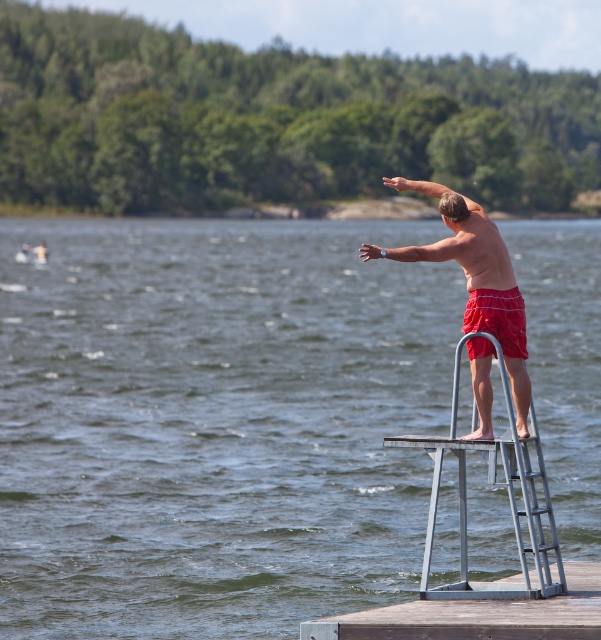
Locate an element on the screen. This screenshot has height=640, width=601. red swim trunks at center is located at coordinates (456, 241).

Describe the element at coordinates (456, 241) in the screenshot. I see `red swim trunks at center` at that location.

Does point (487, 236) come in front of point (501, 332)?

That is False.

Image resolution: width=601 pixels, height=640 pixels. Identify the location of red swim trunks at center. coord(456,241).

Does red cotton shorts at center have a larger size compared to matte white wristwatch at upper right?

Actually, red cotton shorts at center might be smaller than matte white wristwatch at upper right.

Does red cotton shorts at center have a lesser width compared to matte white wristwatch at upper right?

Yes.

Does point (507, 296) come in front of point (444, 252)?

Yes, point (507, 296) is in front of point (444, 252).

This screenshot has height=640, width=601. Identify the location of red cotton shorts at center. (498, 317).

Can you confirm if red swim trunks at center is positioned to the left of matte white wristwatch at upper right?

Incorrect, red swim trunks at center is not on the left side of matte white wristwatch at upper right.

Does point (487, 356) lie behind point (409, 248)?

Yes, point (487, 356) is farther from viewer.

Does point (472, 230) come in front of point (426, 257)?

No, it is behind (426, 257).

At what (x,y) coordinates should I click in order to perform the action: click on red swim trunks at center. Please return your answer as a coordinate pair (x, y). Looking at the image, I should click on (456, 241).